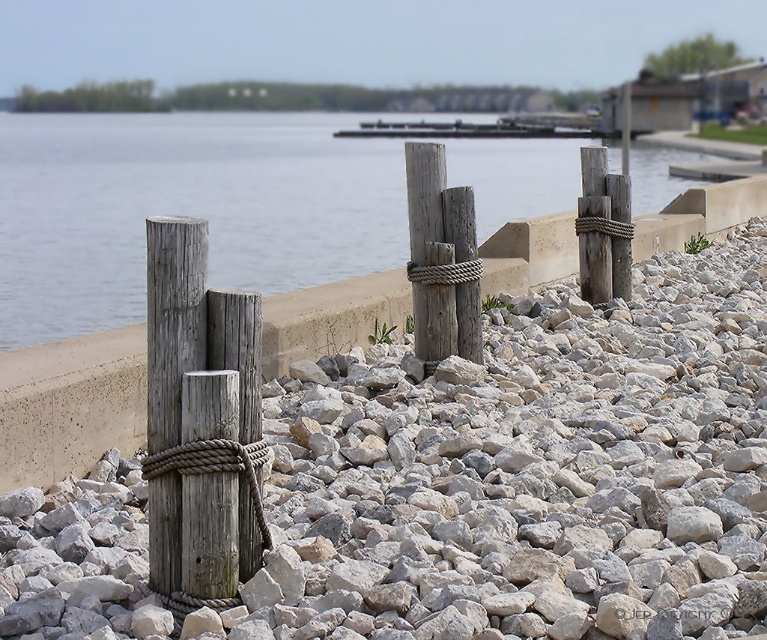
Question: Is the position of transparent water at center less distant than that of weathered wood post at center?

Choices:
 (A) yes
 (B) no

Answer: (A)

Question: Can you confirm if weathered wood post at center-left is positioned to the left of wooden dock at center?

Choices:
 (A) yes
 (B) no

Answer: (A)

Question: Estimate the real-world distances between objects in this image. Which object is closer to the transparent water at center?

Choices:
 (A) weathered wood post at center
 (B) weathered wood post at center-left
 (C) gray gravel at center

Answer: (B)

Question: Estimate the real-world distances between objects in this image. Which object is farther from the transparent water at center?

Choices:
 (A) gray gravel at center
 (B) wooden dock at center
 (C) weathered wood post at center
 (D) weathered wood post at center-left

Answer: (A)

Question: Which point appears closest to the camera in this image?

Choices:
 (A) (486, 132)
 (B) (298, 385)

Answer: (B)

Question: Where is weathered wood post at center-left located in relation to wooden dock at center in the image?

Choices:
 (A) above
 (B) below

Answer: (B)